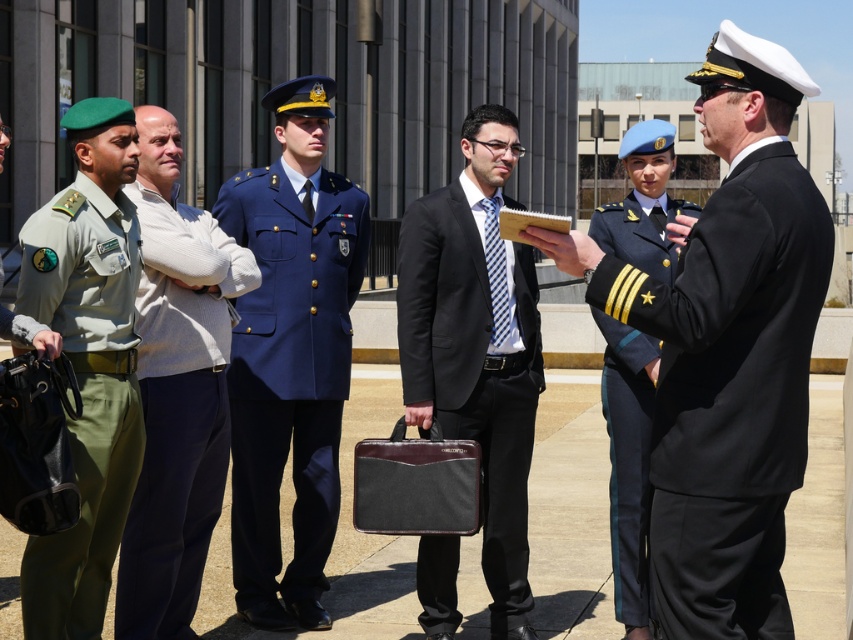
You are observing a group of people in front of a modern building. There is a person in a navy blue fabric uniform at right. Where exactly is this individual positioned in relation to the other people present?

The navy blue fabric uniform at right is located at point (x=729, y=392). This means the individual is positioned slightly to the right and lower portion of the image, closer to the edge compared to others in the scene.

You are a photographer positioned between the navy blue fabric uniform at right and the green fabric uniform at left. The minimum distance required for your camera to focus clearly is 8 feet. Can you capture both uniforms in focus without moving your position?

The navy blue fabric uniform at right is 7.95 feet from the green fabric uniform at left, which is less than the 8 feet required for your camera to focus clearly. Therefore, you cannot capture both uniforms in focus without moving your position.

Based on the photo, you are a photographer at this event and need to ensure all subjects are visible in the photo. Given that the light beige sweater at center and the shiny blue uniform at center are the central figures, which one should you focus on to capture both in frame if the camera has a limited field of view?

The light beige sweater at center might be wider than the shiny blue uniform at center, so focusing on the wider light beige sweater at center would help ensure both are captured within the limited field of view.